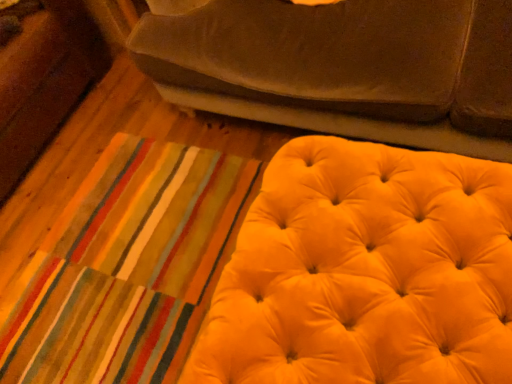
Question: In the image, is yellow velvet ottoman at lower right positioned in front of or behind suede-like brown studio couch at upper center?

Choices:
 (A) behind
 (B) front

Answer: (B)

Question: Would you say yellow velvet ottoman at lower right is inside or outside suede-like brown studio couch at upper center?

Choices:
 (A) outside
 (B) inside

Answer: (A)

Question: Looking at their shapes, would you say yellow velvet ottoman at lower right is wider or thinner than suede-like brown studio couch at upper center?

Choices:
 (A) thin
 (B) wide

Answer: (A)

Question: In terms of size, does suede-like brown studio couch at upper center appear bigger or smaller than yellow velvet ottoman at lower right?

Choices:
 (A) small
 (B) big

Answer: (B)

Question: Would you say suede-like brown studio couch at upper center is to the left or to the right of yellow velvet ottoman at lower right in the picture?

Choices:
 (A) right
 (B) left

Answer: (A)

Question: From a real-world perspective, is suede-like brown studio couch at upper center positioned above or below yellow velvet ottoman at lower right?

Choices:
 (A) below
 (B) above

Answer: (B)

Question: In terms of width, does suede-like brown studio couch at upper center look wider or thinner when compared to yellow velvet ottoman at lower right?

Choices:
 (A) wide
 (B) thin

Answer: (A)